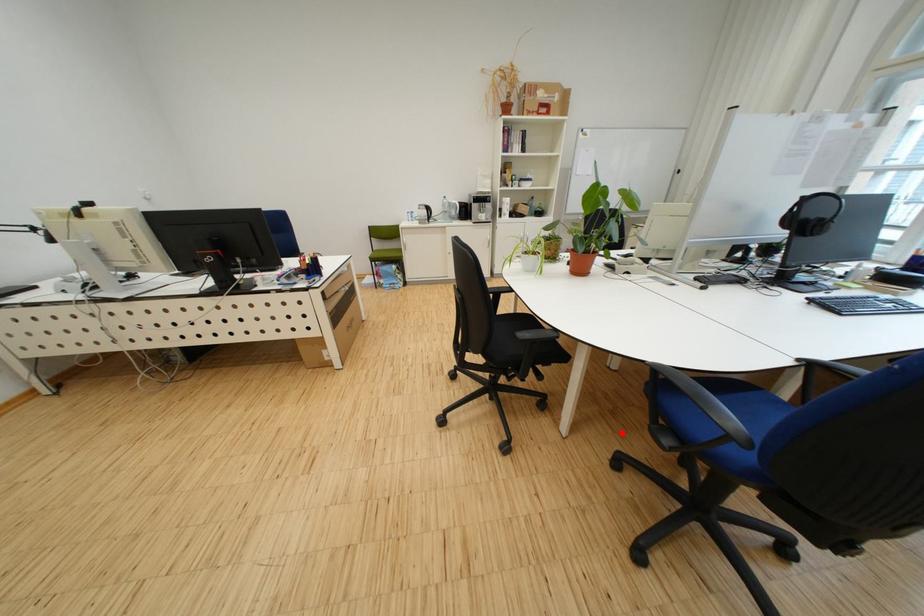
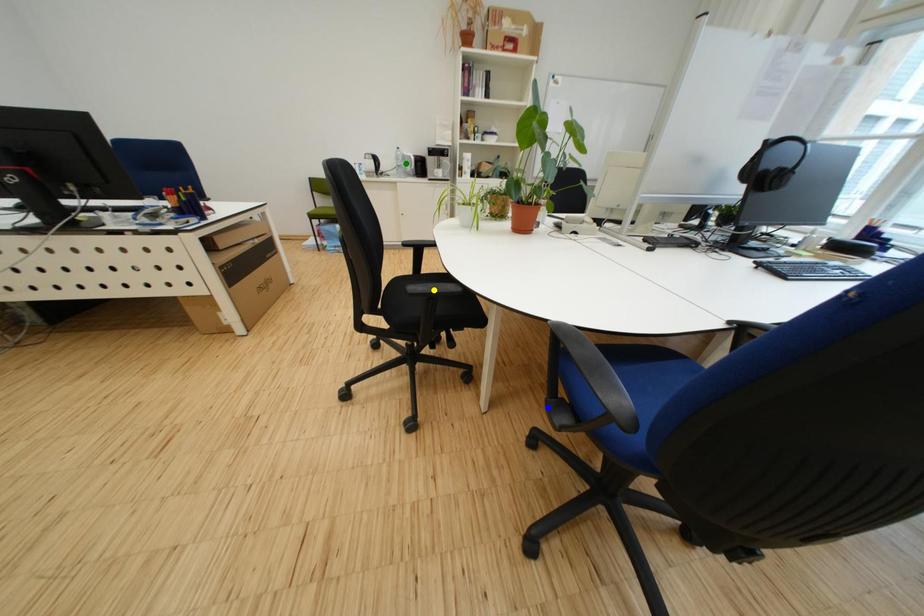
Question: I am providing you with two images of the same scene from different viewpoints. A red point is marked on the first image. You are given multiple points on the second image. Can you choose the point in image 2 that corresponds to the point in image 1?

Choices:
 (A) blue point
 (B) green point
 (C) yellow point

Answer: (A)